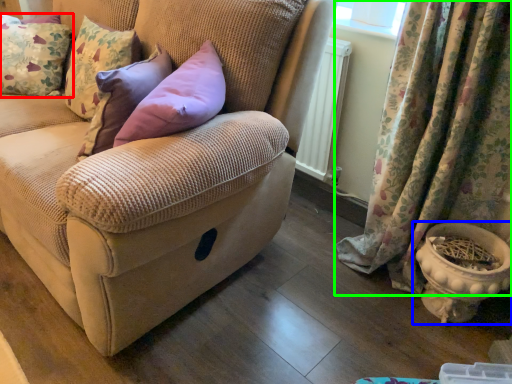
Question: Which object is the closest to the pillow (highlighted by a red box)? Choose among these: flowerpot (highlighted by a blue box) or curtain (highlighted by a green box).

Choices:
 (A) flowerpot
 (B) curtain

Answer: (B)